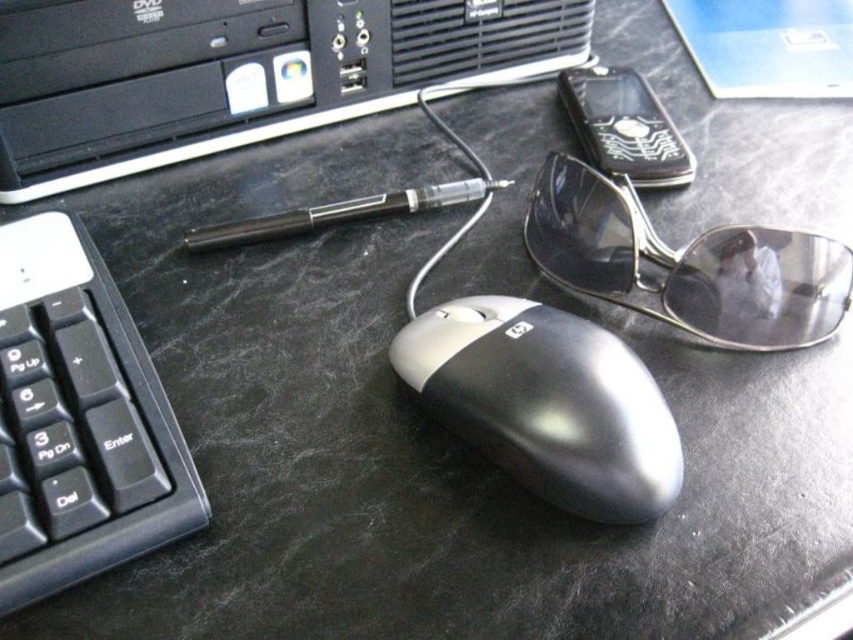
Consider the image. Who is higher up, black plastic computer tower at upper left or sunglasses at center?

Positioned higher is black plastic computer tower at upper left.

Which is below, black plastic computer tower at upper left or sunglasses at center?

sunglasses at center is below.

Who is more forward, (x=155, y=60) or (x=660, y=300)?

Point (x=660, y=300)

The image size is (853, 640). In order to click on black plastic computer tower at upper left in this screenshot , I will do [239, 74].

In order to click on silver/black plastic mouse at center in this screenshot , I will do `click(547, 403)`.

The width and height of the screenshot is (853, 640). Describe the element at coordinates (239, 74) in the screenshot. I see `black plastic computer tower at upper left` at that location.

Is black plastic computer tower at upper left positioned at the back of black plastic keyboard at lower left?

Yes, it is.

Is point (19, 51) behind point (67, 417)?

Yes.

The height and width of the screenshot is (640, 853). What are the coordinates of `black plastic computer tower at upper left` in the screenshot? It's located at (239, 74).